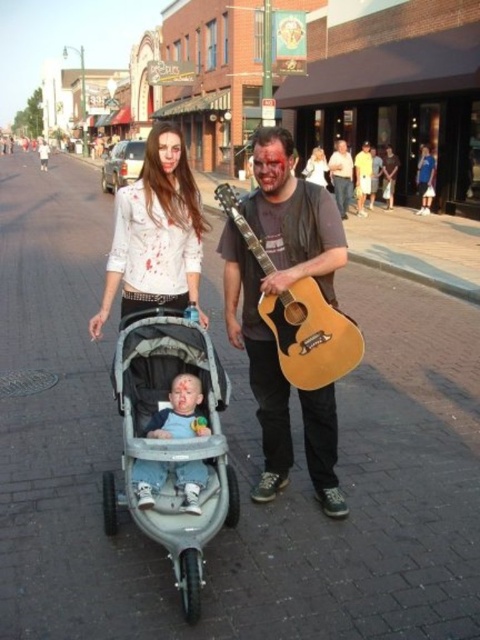
You are a performer carrying a light brown acoustic guitar at center and wearing light blue denim pants at center. You need to adjust your grip on the guitar to hold a microphone. Can you comfortably reach the microphone without moving the guitar closer than 34.17 inches from your pants?

The distance between the light brown acoustic guitar at center and the light blue denim pants at center is 34.17 inches. Since you need to keep the guitar at least that distance from your pants, you can adjust your grip to hold the microphone while maintaining the current separation.

You are a photographer standing in the middle of the street. You want to take a photo of the light brown acoustic guitar at center and the matte yellow shirt at center. Which object should you focus on first to ensure it appears sharp in the photo?

The light brown acoustic guitar at center is closer to the viewer than the matte yellow shirt at center, so you should focus on the light brown acoustic guitar at center first to ensure it appears sharp in the photo.

Looking at this image, you are a photographer standing at the edge of the street. You want to take a photo that includes both the gray plastic stroller at center and the light brown acoustic guitar at center. Given that your camera has a maximum focus range of 90 centimeters, will you be able to capture both objects in focus without moving your position?

The gray plastic stroller at center is 93.29 centimeters from the light brown acoustic guitar at center. Since the distance between them exceeds the camera maximum focus range of 90 centimeters, you will not be able to capture both objects in focus without moving your position.